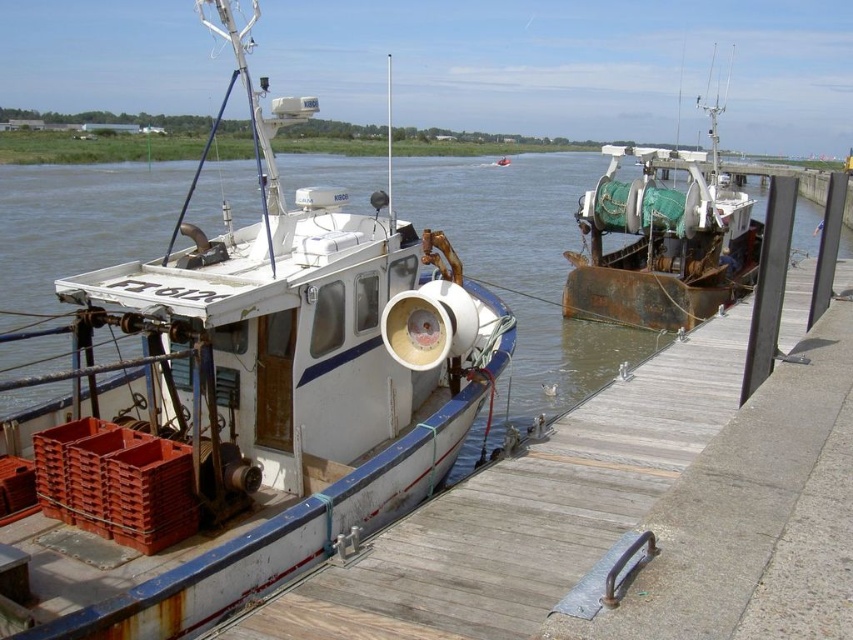
You are standing on the wooden pier and want to walk towards the boat with the sonar device. There are two points marked on the pier at coordinates point (550,556) and point (662,188). Which point should you step on first to head towards the boat with the sonar device?

You should step on point (550,556) first because it is in front of point (662,188), meaning it is closer to the boat with the sonar device.

You are a dock worker who needs to secure both the white matte boat at center and the wooden at left. According to their positions, which boat should you secure first if you start from the dock entrance on the right side of the image?

The wooden at left should be secured first because the white matte boat at center is to the left of the wooden at left, meaning the wooden at left is further to the right and closer to the dock entrance.

You are a dock worker who needs to secure both the wooden at left and the rusty metal boat at right. Which boat requires a wider mooring rope to handle its thickness?

The rusty metal boat at right requires a wider mooring rope because it is thicker than the wooden at left.